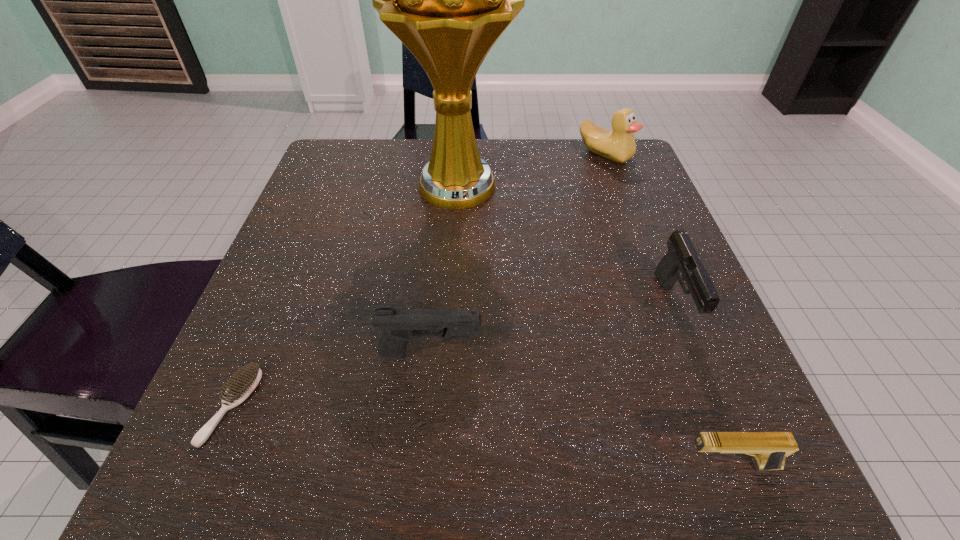
Find the location of a particular element. This screenshot has height=540, width=960. the tallest object is located at coordinates (448, 0).

I want to click on duck, so click(x=618, y=145).

Locate an element on the screen. The image size is (960, 540). the farthest pistol is located at coordinates (682, 262).

This screenshot has height=540, width=960. Identify the location of the leftmost pistol. (399, 325).

I want to click on the second nearest pistol, so click(x=399, y=325).

Where is `the shortest pistol`? This screenshot has width=960, height=540. the shortest pistol is located at coordinates click(x=770, y=449).

What are the coordinates of `the nearest object` in the screenshot? It's located at click(x=770, y=449).

The width and height of the screenshot is (960, 540). Find the location of `the fifth farthest object`. the fifth farthest object is located at coordinates (241, 386).

Where is `the shortest object`? the shortest object is located at coordinates (241, 386).

What are the coordinates of `vacant space positioned 0.060m at the front of the tallest object where the globe is prominent` in the screenshot? It's located at (454, 246).